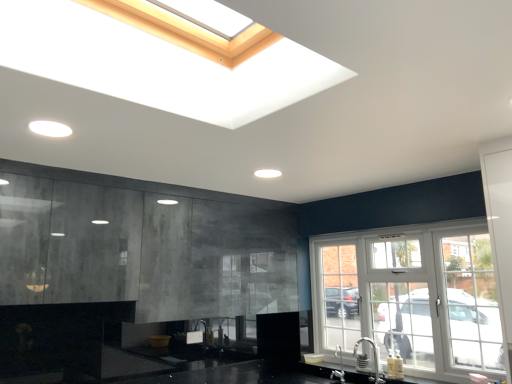
The image size is (512, 384). Describe the element at coordinates (368, 361) in the screenshot. I see `satin nickel faucet at lower center, which ranks as the second faucet in back-to-front order` at that location.

In order to face silver metallic faucet at lower right, which appears as the first faucet when viewed from the back, should I rotate leftwards or rightwards?

To align with it, rotate right about 10.754°.

You are a GUI agent. You are given a task and a screenshot of the screen. Output one action in this format:
    pyautogui.click(x=<x>, y=<y>)
    Task: Click on the matte concrete cabinets at left
    The image size is (512, 384).
    Given the screenshot: What is the action you would take?
    pyautogui.click(x=143, y=250)

Measure the distance between matte concrete cabinets at left and camera.

matte concrete cabinets at left and camera are 2.39 meters apart.

Locate an element on the screen. The height and width of the screenshot is (384, 512). white glass window at right is located at coordinates (411, 297).

Find the location of `satin nickel faucet at lower center, the 2th faucet viewed from the left`. satin nickel faucet at lower center, the 2th faucet viewed from the left is located at coordinates (368, 361).

Which of these two, matte concrete cabinets at left or satin nickel faucet at lower center, the first faucet positioned from the front, is bigger?

Bigger between the two is matte concrete cabinets at left.

From a real-world perspective, does matte concrete cabinets at left stand above satin nickel faucet at lower center, the 2th faucet viewed from the left?

Indeed, from a real-world perspective, matte concrete cabinets at left stands above satin nickel faucet at lower center, the 2th faucet viewed from the left.

Is matte concrete cabinets at left wider or thinner than satin nickel faucet at lower center, which is the first faucet from right to left?

Considering their sizes, matte concrete cabinets at left looks broader than satin nickel faucet at lower center, which is the first faucet from right to left.

Is point (374, 358) closer or farther from the camera than point (323, 283)?

Clearly, point (374, 358) is closer to the camera than point (323, 283).

Considering the positions of objects satin nickel faucet at lower center, which ranks as the second faucet in back-to-front order, and white glass window at right in the image provided, who is more to the right, satin nickel faucet at lower center, which ranks as the second faucet in back-to-front order, or white glass window at right?

From the viewer's perspective, white glass window at right appears more on the right side.

Is white glass window at right inside satin nickel faucet at lower center, which ranks as the second faucet in back-to-front order?

That's incorrect, white glass window at right is not inside satin nickel faucet at lower center, which ranks as the second faucet in back-to-front order.

Is white glass window at right in front of or behind satin nickel faucet at lower center, the 2th faucet viewed from the left, in the image?

white glass window at right is positioned closer to the viewer than satin nickel faucet at lower center, the 2th faucet viewed from the left.

Which faucet is the 1st one when counting from the back of the white glass window at right? Please provide its 2D coordinates.

[(368, 361)]

Who is smaller, white glass window at right or satin nickel faucet at lower center, the 2th faucet viewed from the left?

Smaller between the two is satin nickel faucet at lower center, the 2th faucet viewed from the left.

Does white glass window at right have a greater width compared to satin nickel faucet at lower center, the first faucet positioned from the front?

No.

From their relative heights in the image, would you say silver metallic faucet at lower right, which appears as the first faucet when viewed from the back, is taller or shorter than satin nickel faucet at lower center, which is the first faucet from right to left?

Considering their sizes, silver metallic faucet at lower right, which appears as the first faucet when viewed from the back, has less height than satin nickel faucet at lower center, which is the first faucet from right to left.

In the scene shown: From the image's perspective, does silver metallic faucet at lower right, acting as the second faucet starting from the right, appear higher than satin nickel faucet at lower center, which ranks as the second faucet in back-to-front order?

No, from the image's perspective, silver metallic faucet at lower right, acting as the second faucet starting from the right, is not on top of satin nickel faucet at lower center, which ranks as the second faucet in back-to-front order.

From the picture: What's the angular difference between silver metallic faucet at lower right, acting as the second faucet starting from the right, and satin nickel faucet at lower center, the 2th faucet viewed from the left,'s facing directions?

silver metallic faucet at lower right, acting as the second faucet starting from the right, and satin nickel faucet at lower center, the 2th faucet viewed from the left, are facing 0.000474 degrees away from each other.

Does silver metallic faucet at lower right, which appears as the first faucet when viewed from the back, contain satin nickel faucet at lower center, the first faucet positioned from the front?

Definitely not — satin nickel faucet at lower center, the first faucet positioned from the front, is not inside silver metallic faucet at lower right, which appears as the first faucet when viewed from the back.

Does satin nickel faucet at lower center, which ranks as the second faucet in back-to-front order, appear on the left side of matte concrete cabinets at left?

In fact, satin nickel faucet at lower center, which ranks as the second faucet in back-to-front order, is to the right of matte concrete cabinets at left.

Find the location of a particular element. This screenshot has height=384, width=512. cabinetry above the satin nickel faucet at lower center, the first faucet positioned from the front (from the image's perspective) is located at coordinates (143, 250).

Can you confirm if satin nickel faucet at lower center, the 2th faucet viewed from the left, is taller than matte concrete cabinets at left?

In fact, satin nickel faucet at lower center, the 2th faucet viewed from the left, may be shorter than matte concrete cabinets at left.

Is satin nickel faucet at lower center, the 2th faucet viewed from the left, placed right next to matte concrete cabinets at left?

No, satin nickel faucet at lower center, the 2th faucet viewed from the left, is not next to matte concrete cabinets at left.

In the scene shown: Considering the relative positions of satin nickel faucet at lower center, the 2th faucet viewed from the left, and silver metallic faucet at lower right, which appears as the first faucet when viewed from the back, in the image provided, is satin nickel faucet at lower center, the 2th faucet viewed from the left, to the left of silver metallic faucet at lower right, which appears as the first faucet when viewed from the back, from the viewer's perspective?

In fact, satin nickel faucet at lower center, the 2th faucet viewed from the left, is to the right of silver metallic faucet at lower right, which appears as the first faucet when viewed from the back.

In the scene shown: From the image's perspective, is satin nickel faucet at lower center, which ranks as the second faucet in back-to-front order, under silver metallic faucet at lower right, acting as the first faucet starting from the left?

No.

From a real-world perspective, is satin nickel faucet at lower center, which ranks as the second faucet in back-to-front order, physically above silver metallic faucet at lower right, the 2th faucet when ordered from front to back?

Indeed, from a real-world perspective, satin nickel faucet at lower center, which ranks as the second faucet in back-to-front order, stands above silver metallic faucet at lower right, the 2th faucet when ordered from front to back.

Is satin nickel faucet at lower center, which ranks as the second faucet in back-to-front order, directly adjacent to silver metallic faucet at lower right, which appears as the first faucet when viewed from the back?

satin nickel faucet at lower center, which ranks as the second faucet in back-to-front order, is not next to silver metallic faucet at lower right, which appears as the first faucet when viewed from the back, and they're not touching.

Which object is further away from the camera, silver metallic faucet at lower right, which appears as the first faucet when viewed from the back, or white glass window at right?

Positioned behind is silver metallic faucet at lower right, which appears as the first faucet when viewed from the back.

Is silver metallic faucet at lower right, the 2th faucet when ordered from front to back, spatially inside white glass window at right, or outside of it?

The correct answer is: outside.

Does point (333, 374) appear closer or farther from the camera than point (433, 230)?

Point (333, 374) appears to be farther away from the viewer than point (433, 230).

From a real-world perspective, is silver metallic faucet at lower right, acting as the first faucet starting from the left, over white glass window at right?

Incorrect, from a real-world perspective, silver metallic faucet at lower right, acting as the first faucet starting from the left, is lower than white glass window at right.

Locate an element on the screen. The height and width of the screenshot is (384, 512). cabinetry on the left side of satin nickel faucet at lower center, the first faucet positioned from the front is located at coordinates (143, 250).

You are a GUI agent. You are given a task and a screenshot of the screen. Output one action in this format:
    pyautogui.click(x=<x>, y=<y>)
    Task: Click on the window located above the satin nickel faucet at lower center, which is the first faucet from right to left (from the image's perspective)
    This screenshot has height=384, width=512.
    Given the screenshot: What is the action you would take?
    pyautogui.click(x=411, y=297)

Considering their positions, is silver metallic faucet at lower right, acting as the first faucet starting from the left, positioned further to white glass window at right than satin nickel faucet at lower center, which ranks as the second faucet in back-to-front order?

Based on the image, silver metallic faucet at lower right, acting as the first faucet starting from the left, appears to be further to white glass window at right.

Estimate the real-world distances between objects in this image. Which object is further from matte concrete cabinets at left, white glass window at right or silver metallic faucet at lower right, acting as the second faucet starting from the right?

Based on the image, silver metallic faucet at lower right, acting as the second faucet starting from the right, appears to be further to matte concrete cabinets at left.

Based on their spatial positions, is white glass window at right or matte concrete cabinets at left closer to silver metallic faucet at lower right, acting as the second faucet starting from the right?

The object closer to silver metallic faucet at lower right, acting as the second faucet starting from the right, is white glass window at right.

When comparing their distances from matte concrete cabinets at left, does satin nickel faucet at lower center, which is the first faucet from right to left, or silver metallic faucet at lower right, acting as the second faucet starting from the right, seem further?

silver metallic faucet at lower right, acting as the second faucet starting from the right, is positioned further to the anchor matte concrete cabinets at left.

Looking at the image, which one is located further to satin nickel faucet at lower center, the 2th faucet viewed from the left, white glass window at right or silver metallic faucet at lower right, acting as the second faucet starting from the right?

white glass window at right lies further to satin nickel faucet at lower center, the 2th faucet viewed from the left, than the other object.

Which object lies nearer to the anchor point white glass window at right, silver metallic faucet at lower right, the 2th faucet when ordered from front to back, or matte concrete cabinets at left?

silver metallic faucet at lower right, the 2th faucet when ordered from front to back, is positioned closer to the anchor white glass window at right.

Looking at the image, which one is located closer to white glass window at right, matte concrete cabinets at left or satin nickel faucet at lower center, the 2th faucet viewed from the left?

satin nickel faucet at lower center, the 2th faucet viewed from the left, is positioned closer to the anchor white glass window at right.

Based on their spatial positions, is matte concrete cabinets at left or satin nickel faucet at lower center, the 2th faucet viewed from the left, closer to silver metallic faucet at lower right, acting as the second faucet starting from the right?

Among the two, satin nickel faucet at lower center, the 2th faucet viewed from the left, is located nearer to silver metallic faucet at lower right, acting as the second faucet starting from the right.

You are a GUI agent. You are given a task and a screenshot of the screen. Output one action in this format:
    pyautogui.click(x=<x>, y=<y>)
    Task: Click on the faucet between matte concrete cabinets at left and satin nickel faucet at lower center, the first faucet positioned from the front, from left to right
    The height and width of the screenshot is (384, 512).
    Given the screenshot: What is the action you would take?
    pyautogui.click(x=340, y=367)

The width and height of the screenshot is (512, 384). I want to click on faucet between white glass window at right and silver metallic faucet at lower right, acting as the first faucet starting from the left, from front to back, so click(368, 361).